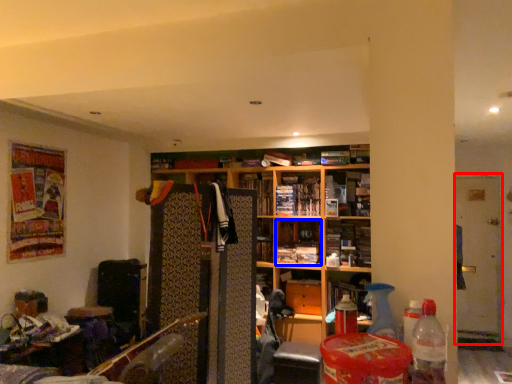
Question: Among these objects, which one is nearest to the camera, glass door (highlighted by a red box) or book (highlighted by a blue box)?

Choices:
 (A) glass door
 (B) book

Answer: (B)